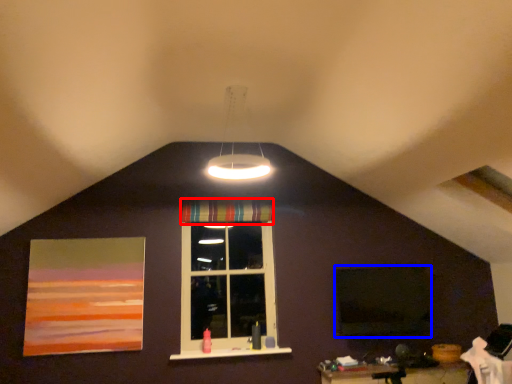
Question: Among these objects, which one is nearest to the camera, curtain (highlighted by a red box) or window screen (highlighted by a blue box)?

Choices:
 (A) curtain
 (B) window screen

Answer: (B)